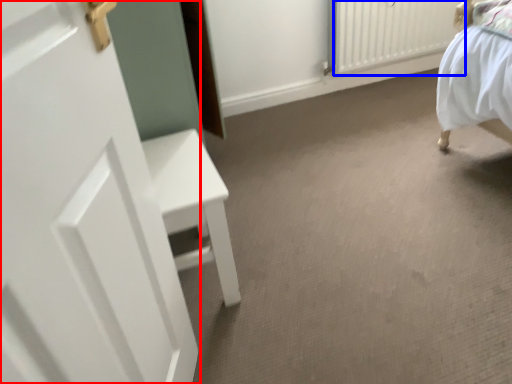
Question: Which object is further to the camera taking this photo, door (highlighted by a red box) or radiator (highlighted by a blue box)?

Choices:
 (A) door
 (B) radiator

Answer: (B)